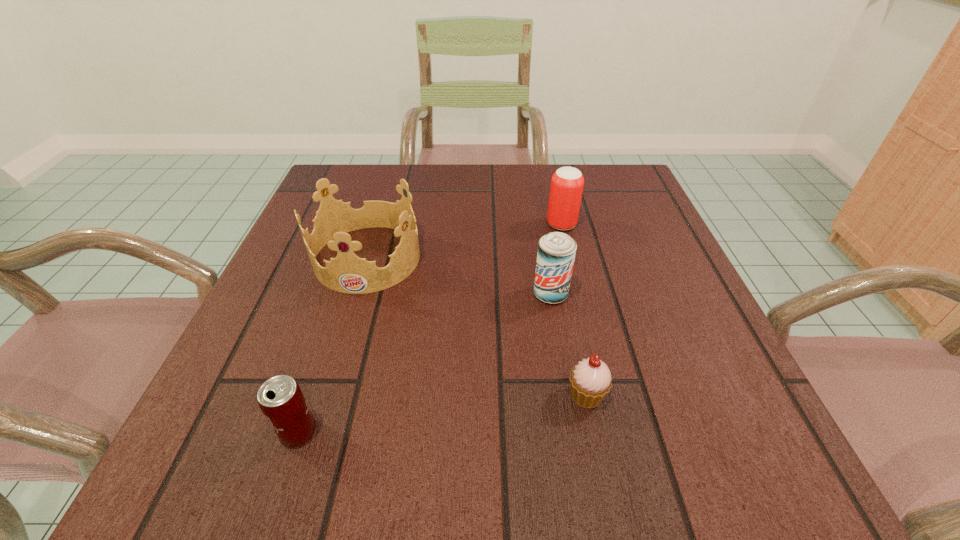
Locate an element on the screen. The image size is (960, 540). free spot that satisfies the following two spatial constraints: 1. on the front-facing side of the tiara; 2. on the right side of the second nearest beer can is located at coordinates (357, 294).